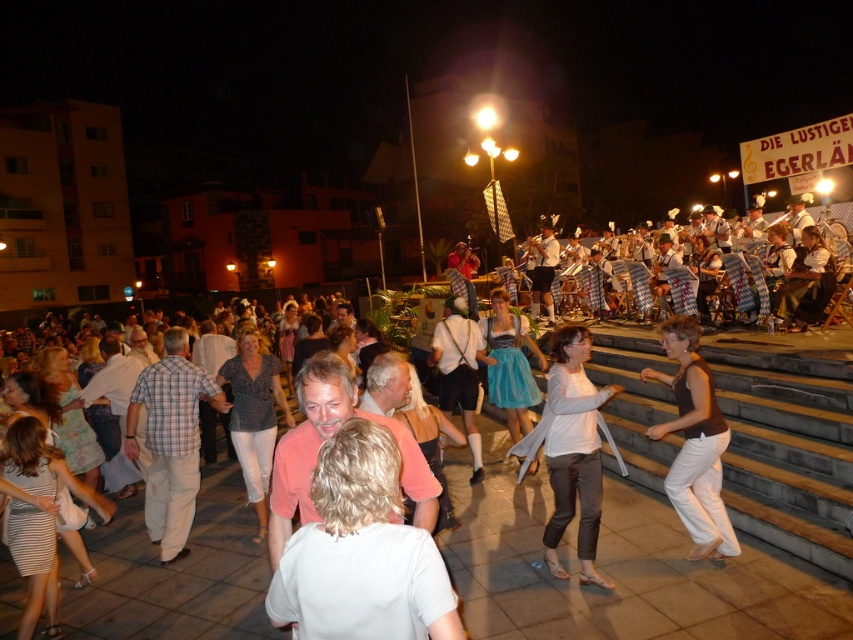
Question: Does white matte pants at center appear on the right side of patterned fabric blouse at center?

Choices:
 (A) no
 (B) yes

Answer: (B)

Question: Which point is farther to the camera?

Choices:
 (A) (231, 368)
 (B) (508, 419)
 (C) (584, 540)
 (D) (701, 472)

Answer: (B)

Question: Among these objects, which one is farthest from the camera?

Choices:
 (A) pink cotton shirt at center
 (B) blue satin dirndl at center
 (C) patterned fabric blouse at center

Answer: (B)

Question: Can you confirm if pink cotton shirt at center is positioned above plaid fabric shirt at center?

Choices:
 (A) yes
 (B) no

Answer: (A)

Question: Which point is farther to the camera?

Choices:
 (A) (239, 442)
 (B) (277, 605)

Answer: (A)

Question: Does patterned fabric blouse at center have a lesser width compared to blue satin dirndl at center?

Choices:
 (A) yes
 (B) no

Answer: (A)